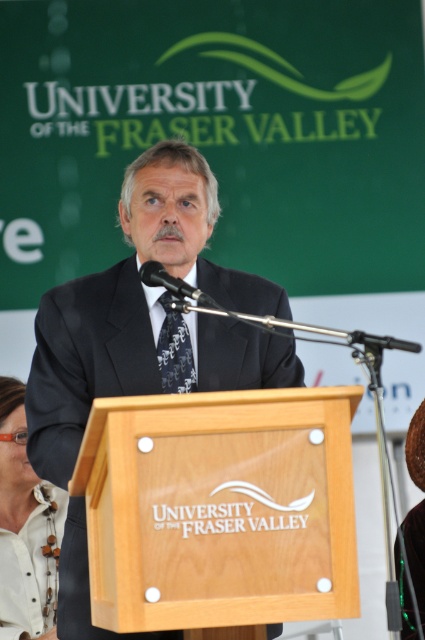
Question: Is white leather necklace at lower left wider than patterned silk tie at center?

Choices:
 (A) yes
 (B) no

Answer: (A)

Question: Among these objects, which one is nearest to the camera?

Choices:
 (A) white leather necklace at lower left
 (B) patterned silk tie at center
 (C) dark suit at center

Answer: (C)

Question: Does dark suit at center appear on the right side of white leather necklace at lower left?

Choices:
 (A) yes
 (B) no

Answer: (A)

Question: Which point is closer to the camera taking this photo?

Choices:
 (A) (144, 636)
 (B) (193, 384)

Answer: (A)

Question: Which point is farther to the camera?

Choices:
 (A) (207, 384)
 (B) (34, 522)

Answer: (B)

Question: Can you confirm if dark suit at center is positioned above white leather necklace at lower left?

Choices:
 (A) no
 (B) yes

Answer: (B)